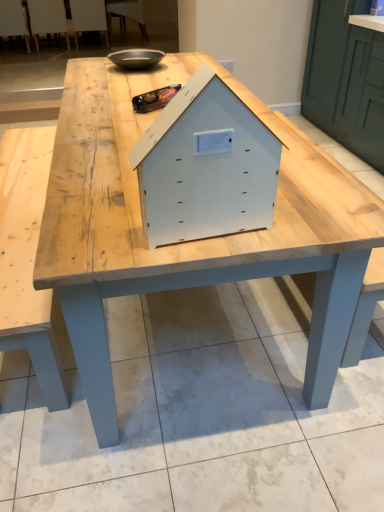
Question: Is white plastic chair at upper left, which is counted as the 3th chair, starting from the left, not within wooden chair at upper left, the first chair positioned from the left?

Choices:
 (A) no
 (B) yes

Answer: (B)

Question: Does white plastic chair at upper left, which is counted as the 3th chair, starting from the left, have a lesser width compared to wooden chair at upper left, the first chair positioned from the left?

Choices:
 (A) no
 (B) yes

Answer: (B)

Question: Is white plastic chair at upper left, which is counted as the 3th chair, starting from the left, to the left of wooden chair at upper left, the first chair positioned from the left, from the viewer's perspective?

Choices:
 (A) no
 (B) yes

Answer: (A)

Question: Is white plastic chair at upper left, the second chair viewed from the right, not close to wooden chair at upper left, the fourth chair in the right-to-left sequence?

Choices:
 (A) no
 (B) yes

Answer: (A)

Question: From a real-world perspective, does white plastic chair at upper left, which is counted as the 3th chair, starting from the left, sit lower than wooden chair at upper left, the fourth chair in the right-to-left sequence?

Choices:
 (A) yes
 (B) no

Answer: (A)

Question: Considering the relative sizes of white plastic chair at upper left, which is counted as the 3th chair, starting from the left, and wooden chair at upper left, the first chair positioned from the left, in the image provided, is white plastic chair at upper left, which is counted as the 3th chair, starting from the left, bigger than wooden chair at upper left, the first chair positioned from the left,?

Choices:
 (A) no
 (B) yes

Answer: (A)

Question: Does matte black bowl at upper center come behind white plastic chair at upper left, which ranks as the 2th chair in left-to-right order?

Choices:
 (A) no
 (B) yes

Answer: (A)

Question: Can white plastic chair at upper left, the 3th chair from the right, be found inside matte black bowl at upper center?

Choices:
 (A) no
 (B) yes

Answer: (A)

Question: Is matte black bowl at upper center smaller than white plastic chair at upper left, the 3th chair from the right?

Choices:
 (A) yes
 (B) no

Answer: (A)

Question: Is matte black bowl at upper center wider than white plastic chair at upper left, the 3th chair from the right?

Choices:
 (A) no
 (B) yes

Answer: (A)

Question: Is matte black bowl at upper center thinner than white plastic chair at upper left, the 3th chair from the right?

Choices:
 (A) no
 (B) yes

Answer: (B)

Question: Considering the relative sizes of matte black bowl at upper center and white plastic chair at upper left, the 3th chair from the right, in the image provided, is matte black bowl at upper center shorter than white plastic chair at upper left, the 3th chair from the right,?

Choices:
 (A) no
 (B) yes

Answer: (B)

Question: Can you confirm if white plastic chair at upper left, which is counted as the 3th chair, starting from the left, is positioned to the right of matte black bowl at upper center?

Choices:
 (A) no
 (B) yes

Answer: (A)